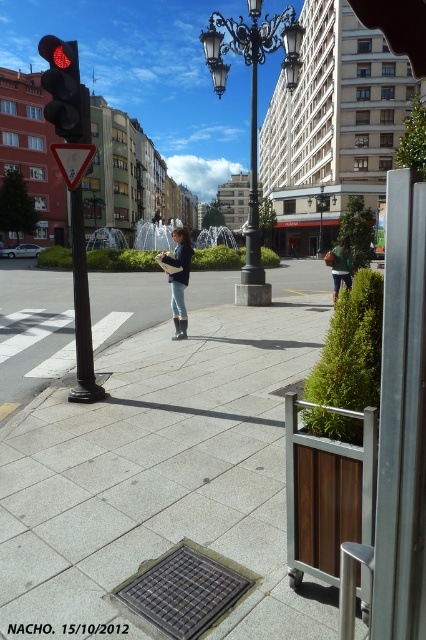
You are standing at the traffic light on the left side of the frame. Which direction should you walk to reach the gray concrete sidewalk at center located at point (164, 461)?

The gray concrete sidewalk at center is located at point (164, 461), so you should walk towards the center of the frame to reach it.

You are standing in the middle of the sidewalk and see two points marked in the scene. Which point is closer to you, point (230,625) or point (215,13)?

Point (230,625) is closer to the viewer than point (215,13).

You are a delivery drone flying over an urban area and need to navigate between two points. The first point is at coordinate point(288, 54) and the second point is at coordinate point(184, 269). According to the scene, which point is closer to the drone if it is positioned at the traffic light on the left side of the frame?

Point(184, 269) is closer to the traffic light on the left side of the frame because it is in front of point(288, 54), which is behind it.